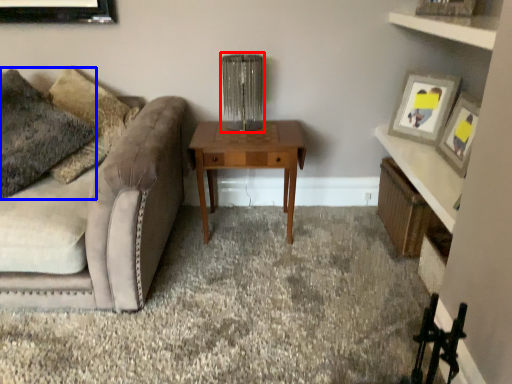
Question: Which of the following is the farthest to the observer, table lamp (highlighted by a red box) or pillow (highlighted by a blue box)?

Choices:
 (A) table lamp
 (B) pillow

Answer: (A)